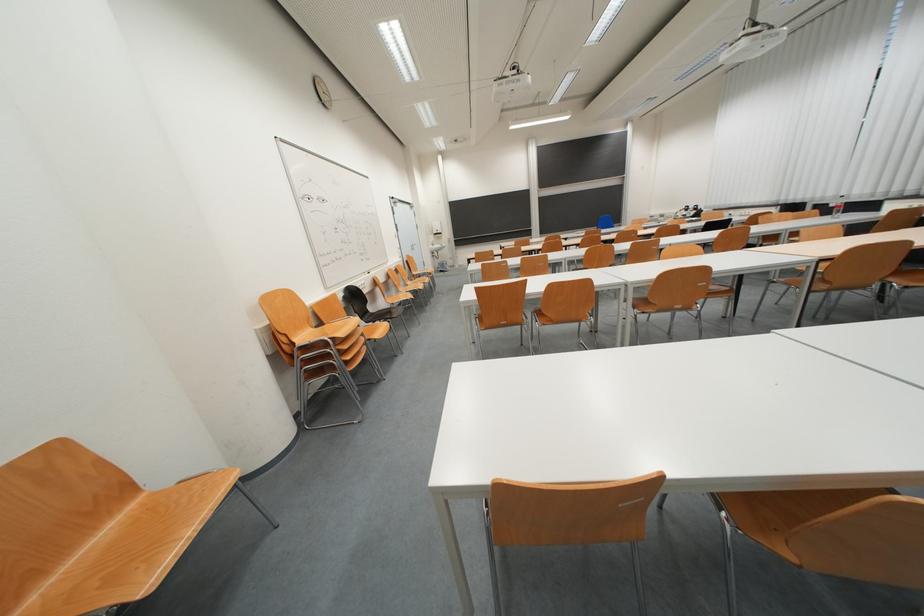
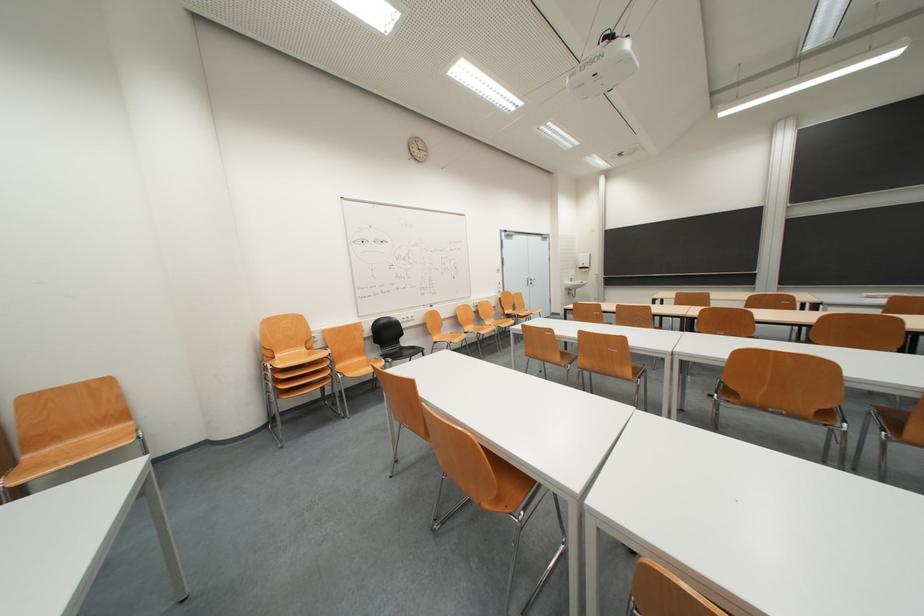
The point at (439, 253) is marked in the first image. Where is the corresponding point in the second image?

(575, 288)